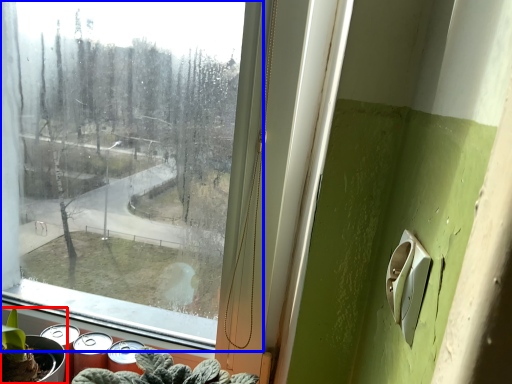
Question: Which of the following is the closest to the observer, houseplant (highlighted by a red box) or window (highlighted by a blue box)?

Choices:
 (A) houseplant
 (B) window

Answer: (B)